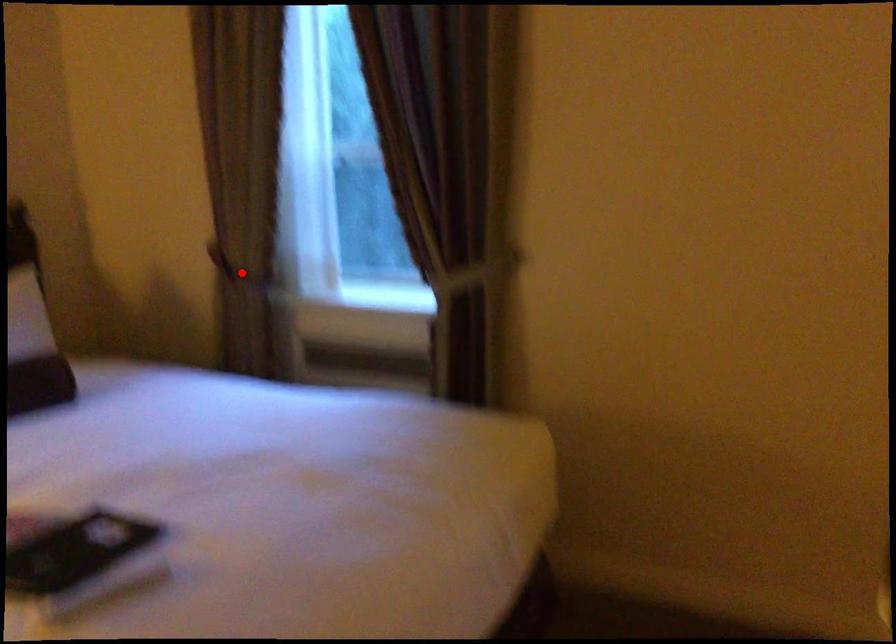
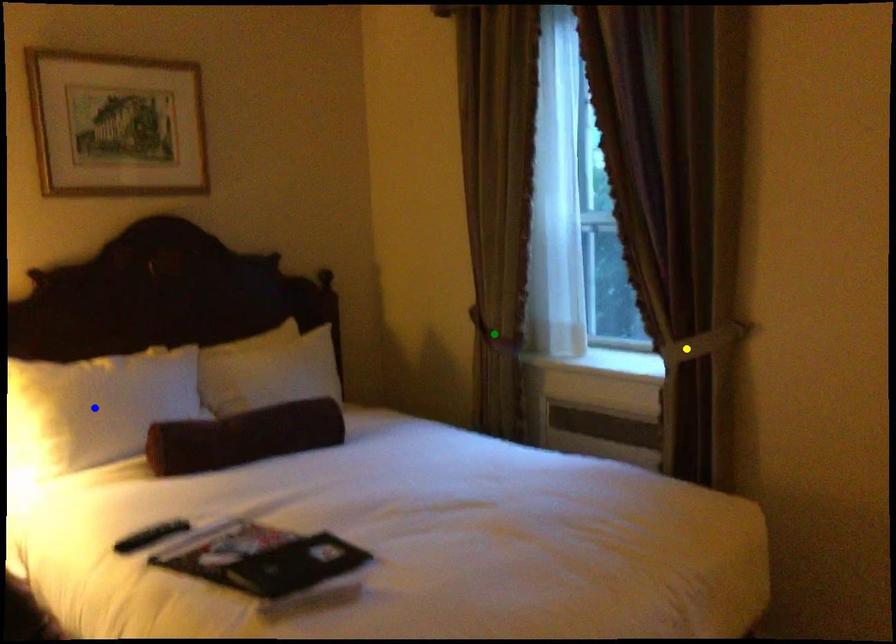
Question: I am providing you with two images of the same scene from different viewpoints. A red point is marked on the first image. You are given multiple points on the second image. Which point in image 2 represents the same 3d spot as the red point in image 1?

Choices:
 (A) yellow point
 (B) blue point
 (C) green point

Answer: (C)